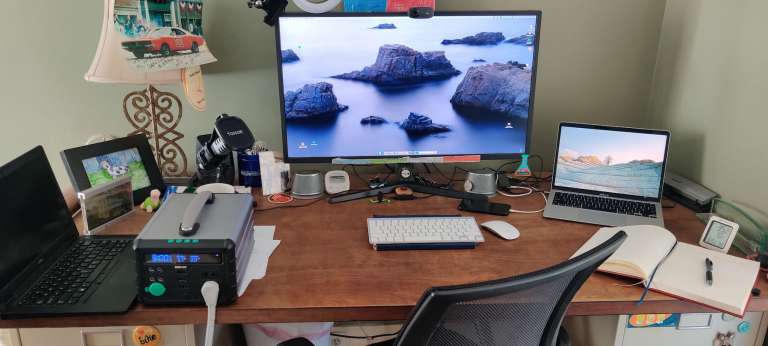
Image resolution: width=768 pixels, height=346 pixels. Find the location of `picture frame with drawing`. picture frame with drawing is located at coordinates (111, 168).